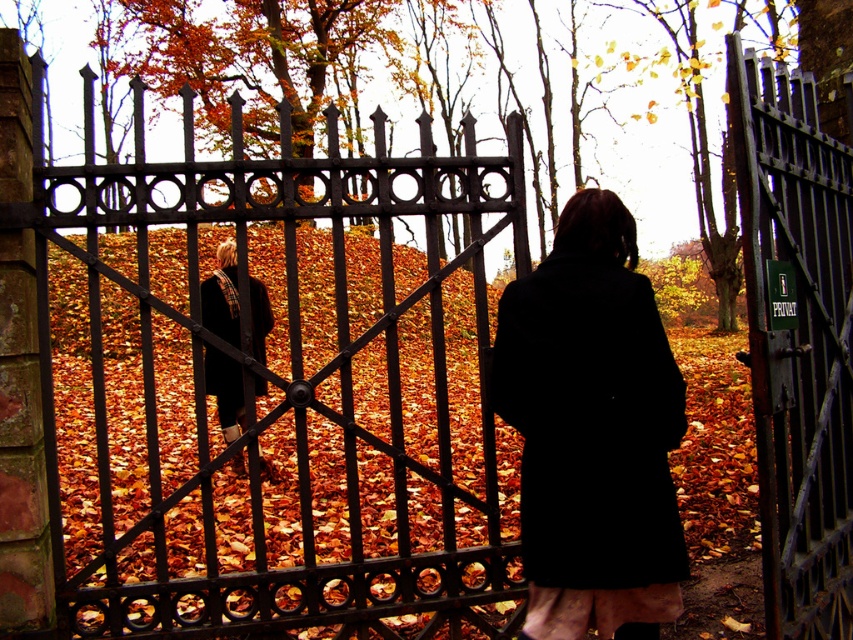
You are a painter standing in the park and want to paint the black wrought iron gate at center and the black matte coat at center. Which object should you focus on first if you want to paint the larger one first?

The black wrought iron gate at center has a larger size compared to the black matte coat at center, so you should focus on painting the black wrought iron gate at center first.